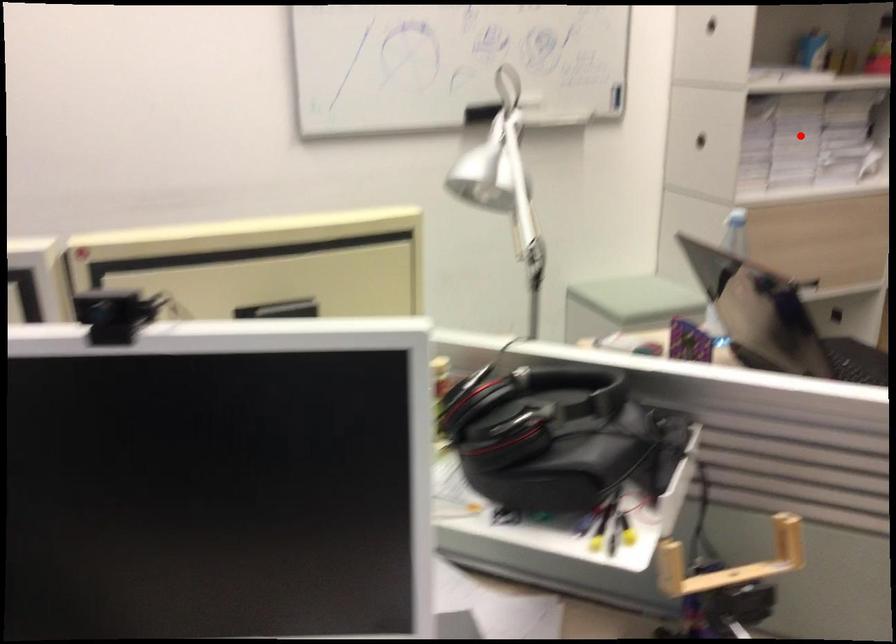
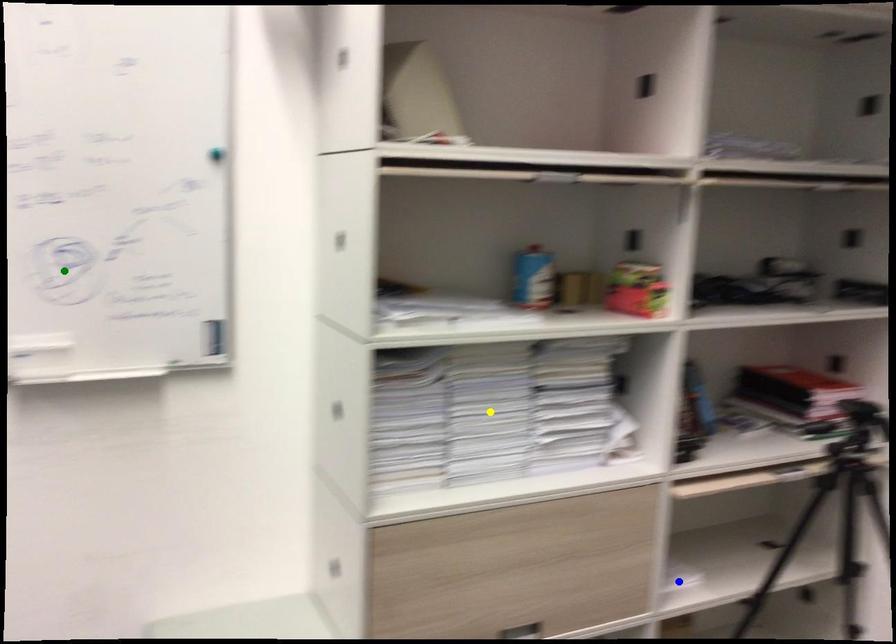
Question: I am providing you with two images of the same scene from different viewpoints. A red point is marked on the first image. You are given multiple points on the second image. In image 2, which mark is for the same physical point as the one in image 1?

Choices:
 (A) yellow point
 (B) blue point
 (C) green point

Answer: (A)